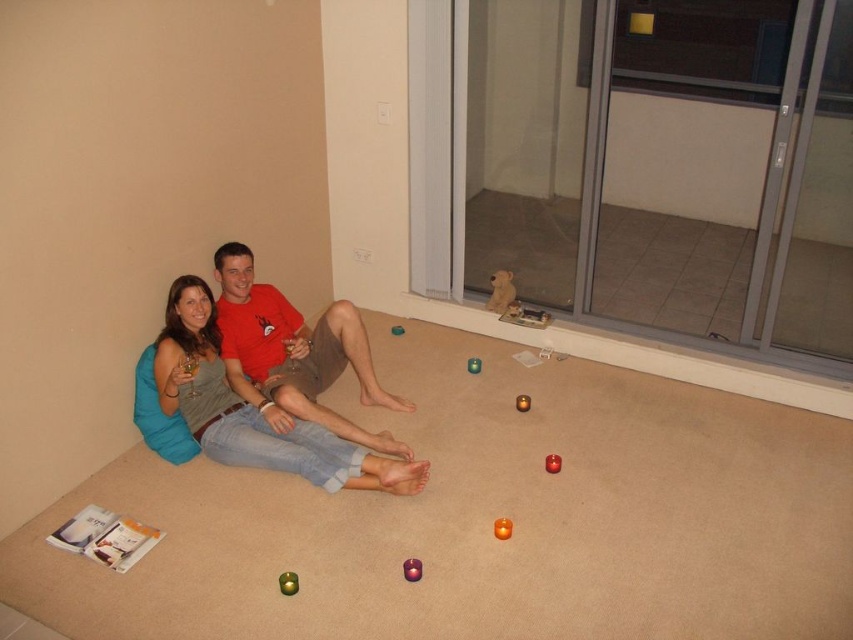
You are a guest in the room and want to place a new toy between the fuzzy fabric dog at upper center and the matte brown teddy bear at center. Based on their positions, where should you position the new toy relative to the teddy bear?

The fuzzy fabric dog at upper center is to the right of the matte brown teddy bear at center, so you should place the new toy to the right of the matte brown teddy bear at center to position it between them.

You are a child who wants to stack the green matte toy at center and the matte brown teddy bear at center. Which one should you place at the bottom to make the stack stable?

The green matte toy at center is taller than the matte brown teddy bear at center, so placing the taller green matte toy at center at the bottom would provide a more stable base for the stack.

You are planning to place a small decorative item on the floor between the matte orange candle at center and the matte brown teddy bear at center. Considering their sizes, which one is taller and would block the view of the other from above?

The matte orange candle at center is much taller than the matte brown teddy bear at center, so it would block the view of the teddy bear from above.